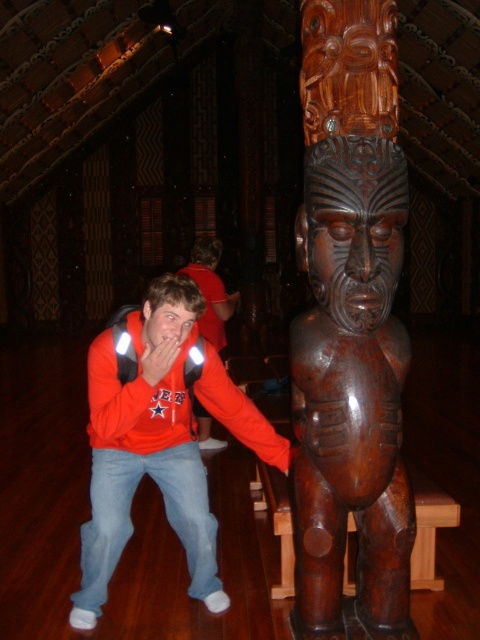
Does point (326, 580) lie behind point (94, 524)?

No, (326, 580) is closer to viewer.

Between point (360, 465) and point (167, 294), which one is positioned behind?

The point (167, 294) is behind.

Is point (294, 525) behind point (248, 422)?

No.

Find the location of a particular element. brown polished wood statue at center is located at coordinates (349, 330).

Does orange fleece jacket at center appear over matte red hoodie at center?

Actually, orange fleece jacket at center is below matte red hoodie at center.

Is point (103, 416) positioned behind point (231, 308)?

No, (103, 416) is in front of (231, 308).

Between point (166, 504) and point (211, 314), which one is positioned behind?

Point (211, 314)

You are a GUI agent. You are given a task and a screenshot of the screen. Output one action in this format:
    pyautogui.click(x=<x>, y=<y>)
    Task: Click on the orange fleece jacket at center
    The width and height of the screenshot is (480, 640).
    Given the screenshot: What is the action you would take?
    pyautogui.click(x=158, y=438)

Based on the photo, does brown polished wood statue at center come behind matte red hoodie at center?

No, brown polished wood statue at center is in front of matte red hoodie at center.

Who is more forward, [383,40] or [220,280]?

Point [383,40] is more forward.

Find the location of `brown polished wood statue at center`. brown polished wood statue at center is located at coordinates (349, 330).